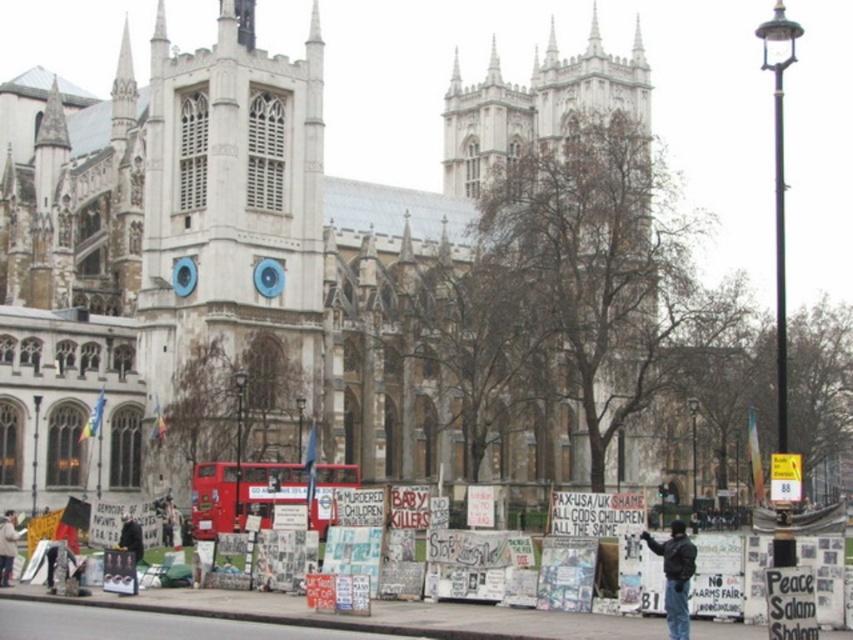
Is point (268, 218) farther from camera compared to point (3, 525)?

Yes, point (268, 218) is farther from viewer.

Who is positioned more to the left, white stone church at center or dark brown leather jacket at lower left?

Positioned to the left is dark brown leather jacket at lower left.

Image resolution: width=853 pixels, height=640 pixels. In order to click on white stone church at center in this screenshot , I will do `click(328, 275)`.

Locate an element on the screen. white stone church at center is located at coordinates (328, 275).

Based on the photo, is white stone church at center to the left of dark blue jacket at lower right from the viewer's perspective?

Yes, white stone church at center is to the left of dark blue jacket at lower right.

Describe the element at coordinates (328, 275) in the screenshot. The image size is (853, 640). I see `white stone church at center` at that location.

Locate an element on the screen. The image size is (853, 640). white stone church at center is located at coordinates (328, 275).

Is dark blue jacket at lower right further to camera compared to dark brown leather jacket at lower left?

That is False.

Is point (669, 618) positioned in front of point (12, 557)?

Yes, point (669, 618) is closer to viewer.

The height and width of the screenshot is (640, 853). Identify the location of dark blue jacket at lower right. (675, 576).